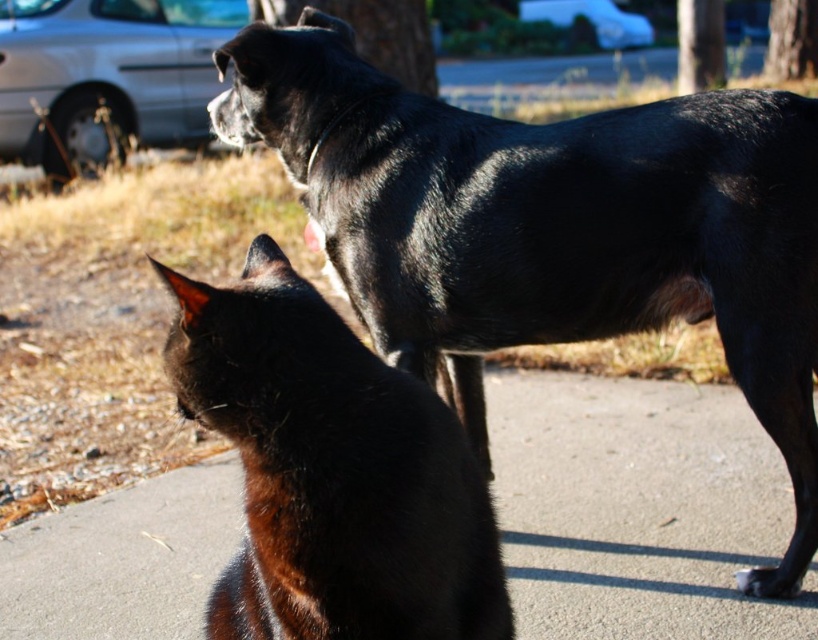
You are a photographer trying to capture both the shiny black cat at center and the silver metallic car at upper left in the same frame. Based on their sizes, which one should you focus on first to ensure they both fit in the shot?

The shiny black cat at center is thinner than the silver metallic car at upper left, so you should focus on the silver metallic car at upper left first to ensure both fit in the shot.

You are a small robot with a width of 12 inches. You need to move from the smooth concrete pavement at lower center to the black fur paw at lower right. Can you fit through the space between them?

The distance between the smooth concrete pavement at lower center and the black fur paw at lower right is 22.53 inches. Since your width is 12 inches, you can fit through the space as it is wider than your width.

You are a gardener who needs to place a small potted plant between the smooth concrete pavement at lower center and the black fur paw at lower right. Which object should the plant be closer to based on their sizes?

The smooth concrete pavement at lower center is larger in size than the black fur paw at lower right, so the plant should be placed closer to the black fur paw at lower right to ensure it fits within the available space.